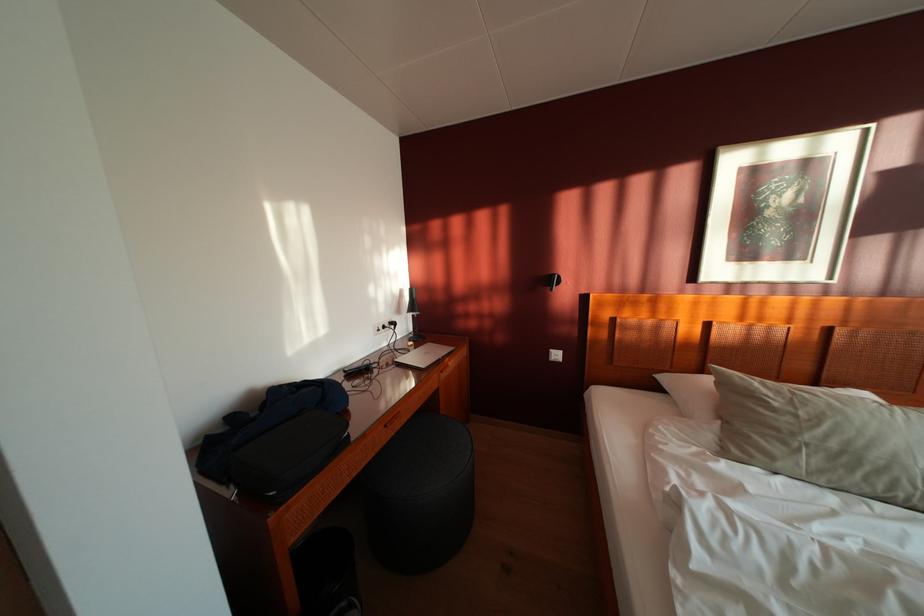
The location [325,573] corresponds to which object?

It corresponds to the black trash can in the image.